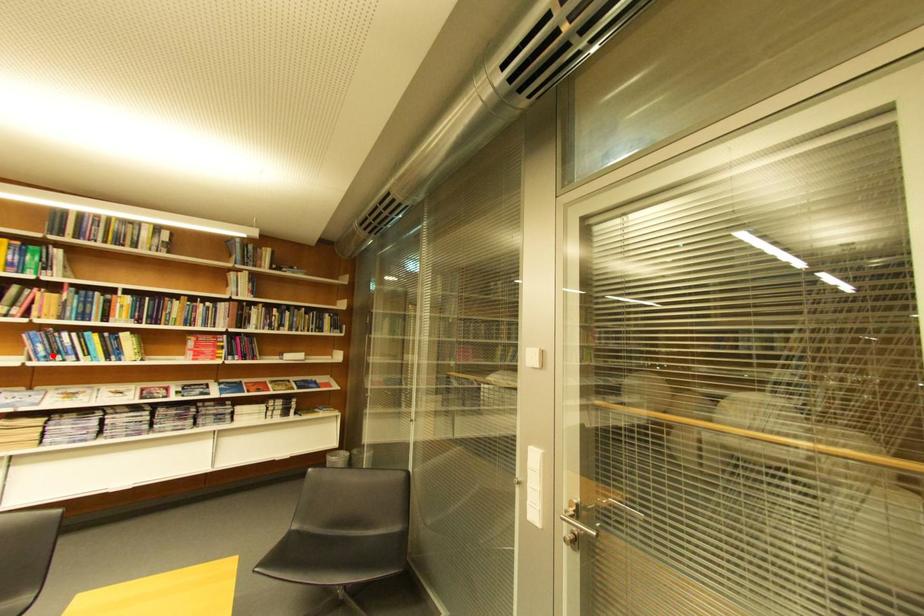
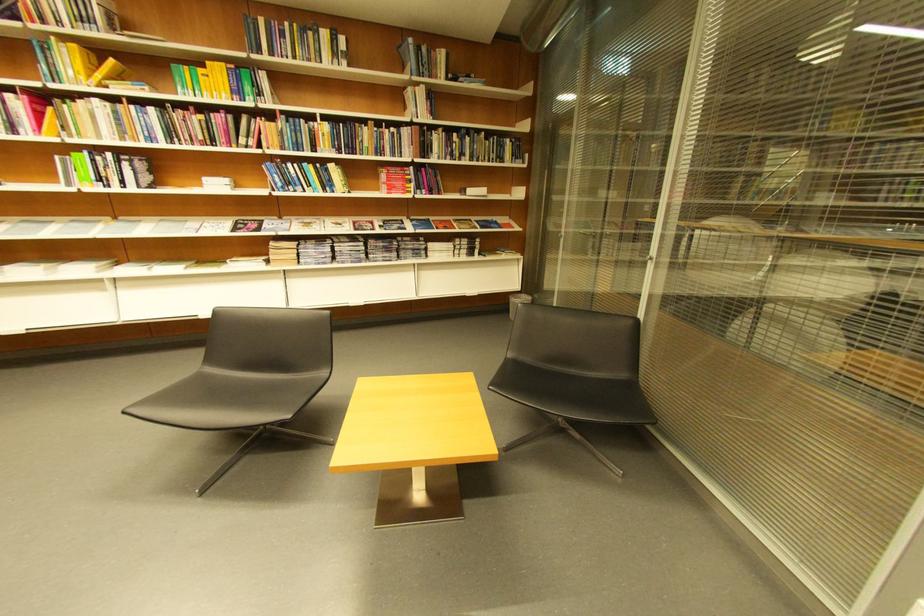
In the second image, find the point that corresponds to the highlighted location in the first image.

(290, 185)